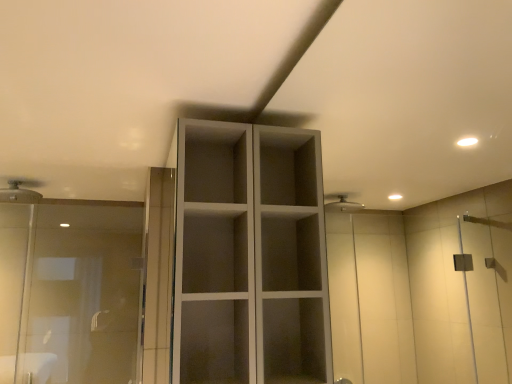
Question: Is transparent glass shower door at left not inside white matte cupboard at center?

Choices:
 (A) no
 (B) yes

Answer: (B)

Question: Is transparent glass shower door at left at the left side of white matte cupboard at center?

Choices:
 (A) no
 (B) yes

Answer: (B)

Question: Considering the relative sizes of transparent glass shower door at left and white matte cupboard at center in the image provided, is transparent glass shower door at left bigger than white matte cupboard at center?

Choices:
 (A) yes
 (B) no

Answer: (B)

Question: Is transparent glass shower door at left smaller than white matte cupboard at center?

Choices:
 (A) no
 (B) yes

Answer: (B)

Question: Is transparent glass shower door at left in contact with white matte cupboard at center?

Choices:
 (A) yes
 (B) no

Answer: (B)

Question: Is white matte cupboard at center bigger or smaller than matte white shower head at upper left?

Choices:
 (A) small
 (B) big

Answer: (B)

Question: Does point (174, 360) appear closer or farther from the camera than point (8, 188)?

Choices:
 (A) closer
 (B) farther

Answer: (A)

Question: Choose the correct answer: Is white matte cupboard at center inside matte white shower head at upper left or outside it?

Choices:
 (A) outside
 (B) inside

Answer: (A)

Question: Considering the positions of white matte cupboard at center and matte white shower head at upper left in the image, is white matte cupboard at center wider or thinner than matte white shower head at upper left?

Choices:
 (A) wide
 (B) thin

Answer: (B)

Question: Is transparent glass shower door at left to the left or to the right of white matte cupboard at center in the image?

Choices:
 (A) right
 (B) left

Answer: (B)

Question: From the image's perspective, relative to white matte cupboard at center, is transparent glass shower door at left above or below?

Choices:
 (A) above
 (B) below

Answer: (B)

Question: Considering their positions, is transparent glass shower door at left located in front of or behind white matte cupboard at center?

Choices:
 (A) behind
 (B) front

Answer: (A)

Question: Choose the correct answer: Is transparent glass shower door at left inside white matte cupboard at center or outside it?

Choices:
 (A) inside
 (B) outside

Answer: (B)

Question: Looking at their shapes, would you say matte white shower head at upper left is wider or thinner than white matte cupboard at center?

Choices:
 (A) thin
 (B) wide

Answer: (B)

Question: From the image's perspective, relative to white matte cupboard at center, is matte white shower head at upper left above or below?

Choices:
 (A) above
 (B) below

Answer: (A)